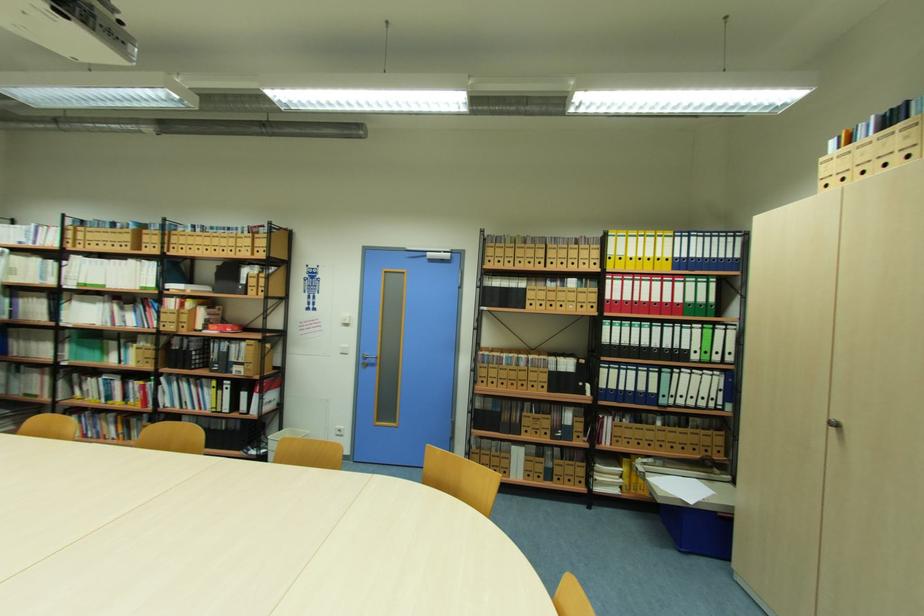
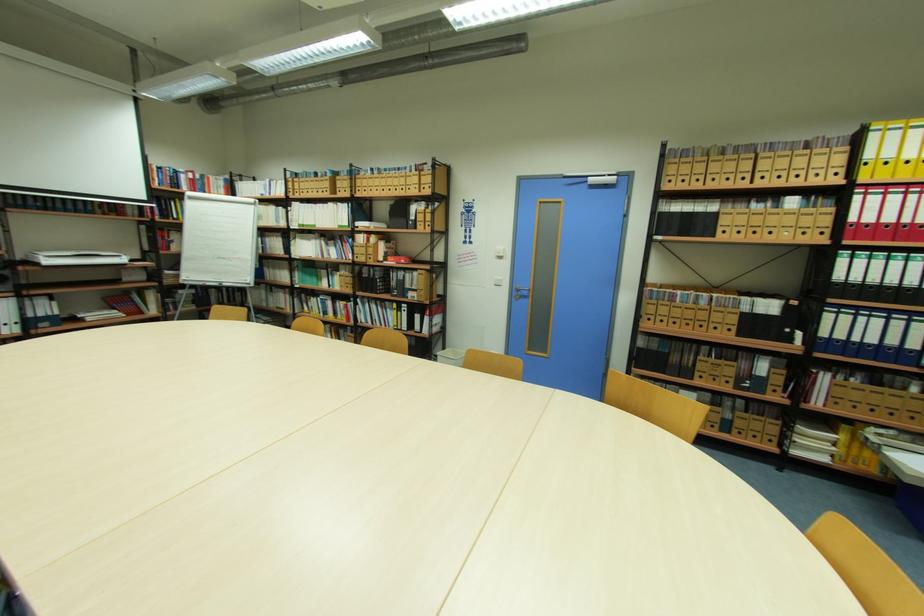
Question: The camera is either moving clockwise (left) or counter-clockwise (right) around the object. The first image is from the beginning of the video and the second image is from the end. Is the camera moving left or right when shooting the video?

Choices:
 (A) Left
 (B) Right

Answer: (B)